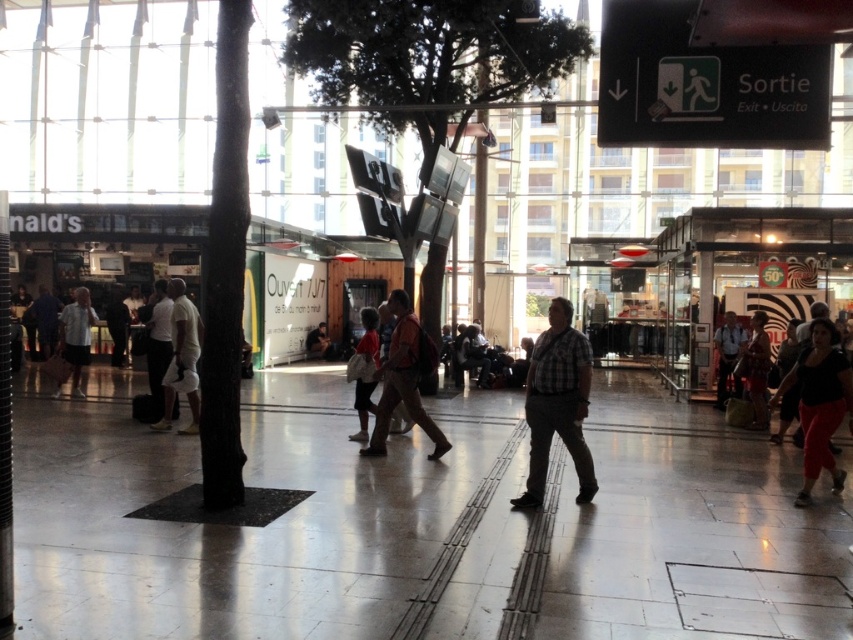
Can you confirm if white matte shorts at center is positioned to the left of matte black suitcase at center?

No, white matte shorts at center is not to the left of matte black suitcase at center.

Is point (164, 381) positioned in front of point (161, 310)?

Yes.

This screenshot has width=853, height=640. In order to click on white matte shorts at center in this screenshot , I will do `click(181, 358)`.

Is matte black suitcase at center closer to the viewer compared to dark blue shirt at center?

Yes.

Locate an element on the screen. The height and width of the screenshot is (640, 853). matte black suitcase at center is located at coordinates [158, 348].

This screenshot has height=640, width=853. I want to click on matte black suitcase at center, so point(158,348).

Is brown leather jacket at center thinner than dark blue shirt at center?

Yes, brown leather jacket at center is thinner than dark blue shirt at center.

Can you confirm if brown leather jacket at center is shorter than dark blue shirt at center?

In fact, brown leather jacket at center may be taller than dark blue shirt at center.

Is point (415, 317) in front of point (51, 352)?

Yes.

Where is `brown leather jacket at center`? This screenshot has height=640, width=853. brown leather jacket at center is located at coordinates (402, 380).